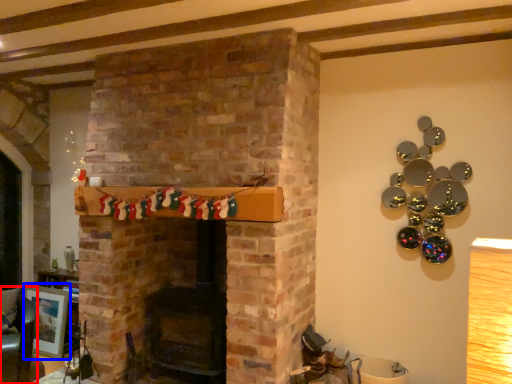
Question: Which object is further to the camera taking this photo, armchair (highlighted by a red box) or picture frame (highlighted by a blue box)?

Choices:
 (A) armchair
 (B) picture frame

Answer: (B)